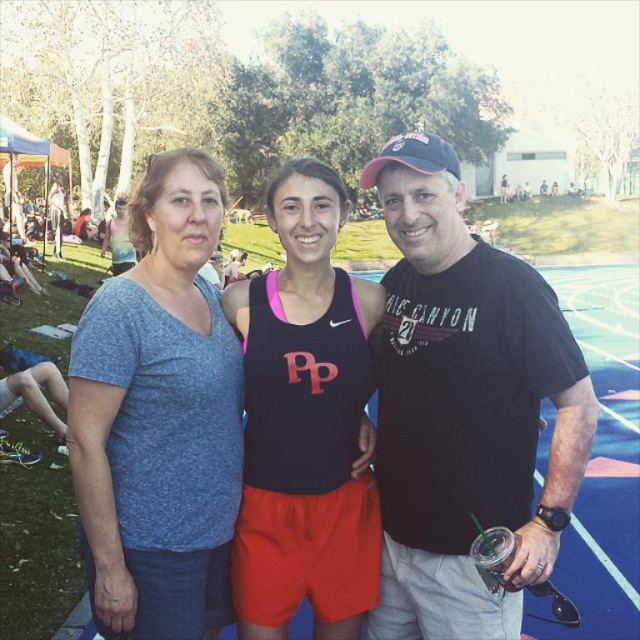
Is point (209, 358) more distant than point (244, 573)?

No, it is in front of (244, 573).

Which is in front, point (118, 452) or point (314, 476)?

Positioned in front is point (118, 452).

Which is behind, point (168, 248) or point (337, 492)?

Point (168, 248)

Where is `blue cotton shirt at center`? The image size is (640, 640). blue cotton shirt at center is located at coordinates (160, 417).

Between black cotton t-shirt at right and black matte tank top at center, which one appears on the right side from the viewer's perspective?

black cotton t-shirt at right is more to the right.

Based on the photo, is black cotton t-shirt at right further to the viewer compared to black matte tank top at center?

No, it is not.

Between point (426, 275) and point (259, 304), which one is positioned behind?

Point (259, 304)

The height and width of the screenshot is (640, 640). I want to click on black cotton t-shirt at right, so click(465, 406).

Who is shorter, black cotton t-shirt at right or blue cotton shirt at center?

blue cotton shirt at center is shorter.

Describe the element at coordinates (465, 406) in the screenshot. This screenshot has height=640, width=640. I see `black cotton t-shirt at right` at that location.

Locate an element on the screen. Image resolution: width=640 pixels, height=640 pixels. black cotton t-shirt at right is located at coordinates pos(465,406).

Where is `black cotton t-shirt at right`? black cotton t-shirt at right is located at coordinates (465, 406).